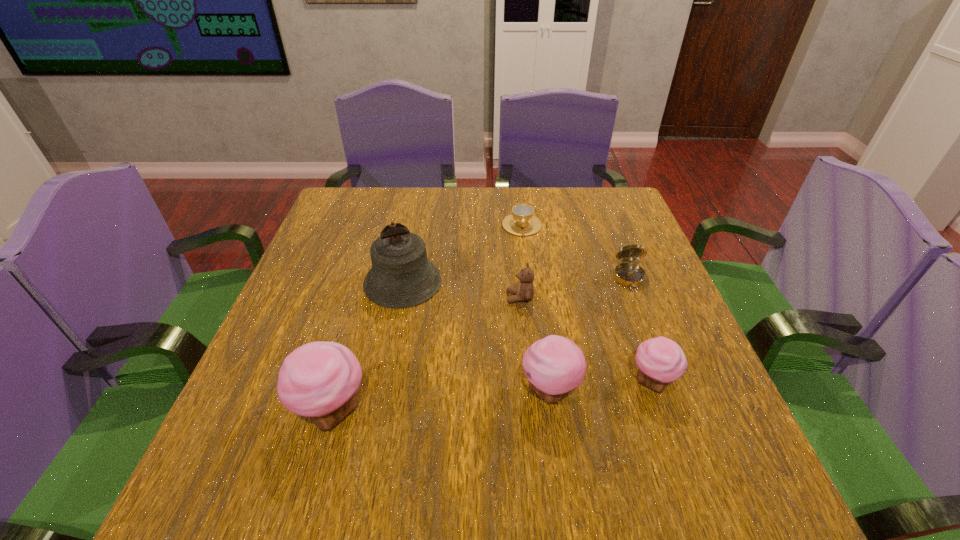
Where is `object that is at the left edge`? This screenshot has width=960, height=540. object that is at the left edge is located at coordinates (319, 380).

The width and height of the screenshot is (960, 540). In order to click on cupcake that is positioned at the right edge in this screenshot , I will do `click(660, 360)`.

Where is `compass present at the right edge`? compass present at the right edge is located at coordinates (627, 274).

I want to click on object that is at the near left corner, so click(319, 380).

In order to click on free space at the far edge of the desktop in this screenshot , I will do `click(553, 206)`.

I want to click on vacant space at the near edge of the desktop, so click(x=607, y=441).

Identify the location of free region at the left edge of the desktop. (283, 349).

Image resolution: width=960 pixels, height=540 pixels. Find the location of `free space at the right edge of the desktop`. free space at the right edge of the desktop is located at coordinates (618, 294).

Find the location of a particular element. free spot at the far left corner of the desktop is located at coordinates (361, 187).

Identify the location of free space between the rightmost cupcake and the cup. (587, 303).